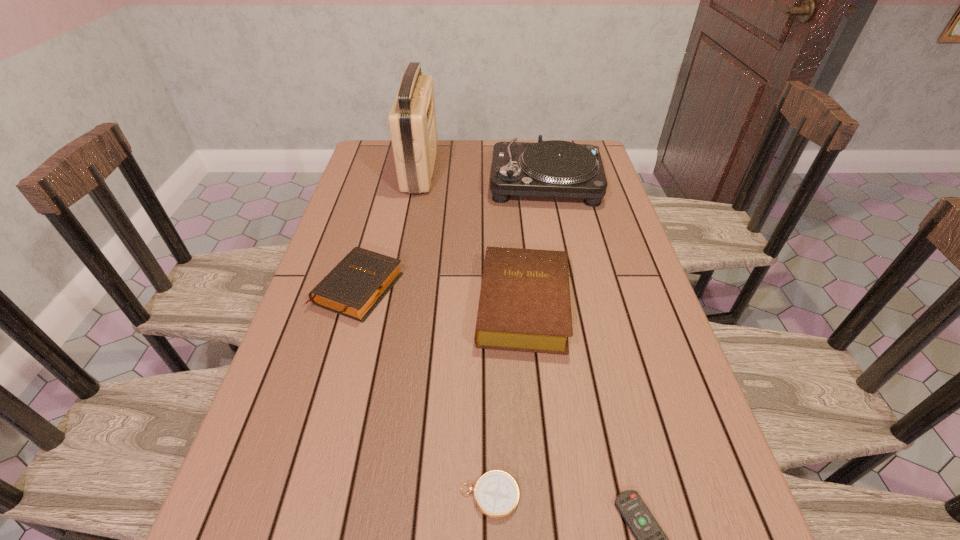
Where is `radio receiver`? The image size is (960, 540). radio receiver is located at coordinates (412, 120).

At what (x,y) coordinates should I click in order to perform the action: click on the fifth shortest object. Please return your answer as a coordinate pair (x, y). The width and height of the screenshot is (960, 540). Looking at the image, I should click on (554, 168).

Image resolution: width=960 pixels, height=540 pixels. I want to click on the right Bible, so click(x=524, y=305).

The height and width of the screenshot is (540, 960). Find the location of `the taller Bible`. the taller Bible is located at coordinates tap(524, 305).

Locate an element on the screen. The width and height of the screenshot is (960, 540). the left Bible is located at coordinates (359, 282).

This screenshot has width=960, height=540. Identify the location of the third shortest object. tap(359, 282).

You are a GUI agent. You are given a task and a screenshot of the screen. Output one action in this format:
    pyautogui.click(x=<x>, y=<y>)
    Task: Click on the compass
    The height and width of the screenshot is (540, 960).
    Given the screenshot: What is the action you would take?
    pyautogui.click(x=496, y=493)

This screenshot has height=540, width=960. Find the location of `blank space located 0.400m on the front-facing side of the radio receiver`. blank space located 0.400m on the front-facing side of the radio receiver is located at coordinates (551, 168).

Where is `free space located 0.310m on the left of the second tallest object`? This screenshot has height=540, width=960. free space located 0.310m on the left of the second tallest object is located at coordinates (396, 184).

You are a GUI agent. You are given a task and a screenshot of the screen. Output one action in this format:
    pyautogui.click(x=<x>, y=<y>)
    Task: Click on the free space located on the front of the fourth shortest object
    Image resolution: width=960 pixels, height=540 pixels.
    Given the screenshot: What is the action you would take?
    pyautogui.click(x=545, y=539)